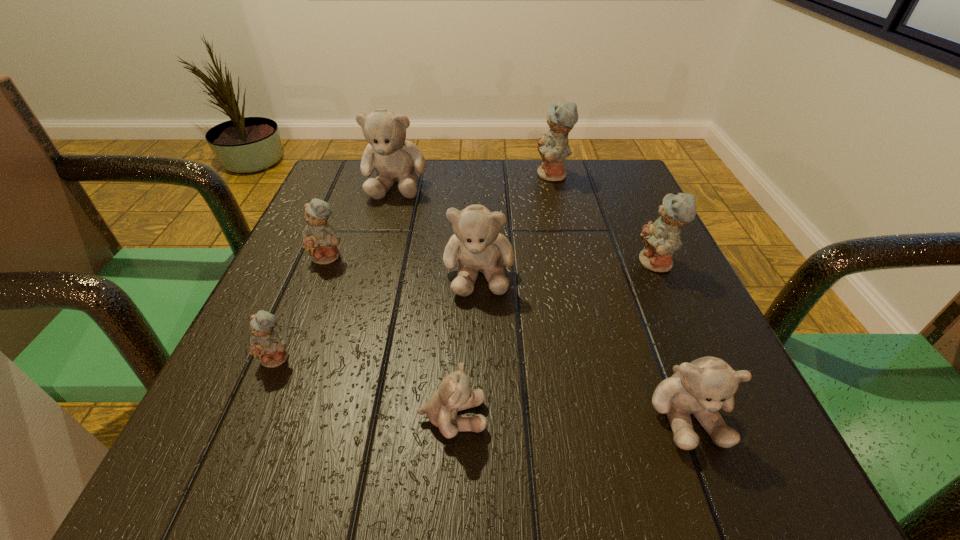
Image resolution: width=960 pixels, height=540 pixels. Find the location of `the smallest gray teddy bear`. the smallest gray teddy bear is located at coordinates (454, 394).

The image size is (960, 540). In order to click on vacant space located 0.250m on the front-facing side of the second blue teddy bear from right to left in this screenshot , I will do `click(431, 176)`.

Where is `vacant space located 0.180m on the front-facing side of the second blue teddy bear from right to left`? vacant space located 0.180m on the front-facing side of the second blue teddy bear from right to left is located at coordinates (460, 176).

This screenshot has width=960, height=540. In order to click on vacant area located 0.190m on the front-facing side of the second blue teddy bear from right to left in this screenshot , I will do `click(456, 176)`.

At what (x,y) coordinates should I click in order to perform the action: click on free region located 0.180m on the face of the biggest gray teddy bear. Please return your answer as a coordinate pair (x, y). Looking at the image, I should click on (375, 256).

At what (x,y) coordinates should I click in order to perform the action: click on vacant space located 0.270m on the front-facing side of the rightmost blue teddy bear. Please return your answer as a coordinate pair (x, y). Looking at the image, I should click on (492, 264).

I want to click on free spot located 0.260m on the front-facing side of the rightmost blue teddy bear, so tap(497, 264).

Locate an element on the screen. vacant space located 0.210m on the front-facing side of the rightmost blue teddy bear is located at coordinates (524, 264).

Where is `free spot located 0.130m on the face of the third smallest gray teddy bear`? free spot located 0.130m on the face of the third smallest gray teddy bear is located at coordinates (478, 366).

Locate an element on the screen. free location located 0.310m on the front-facing side of the second smallest blue teddy bear is located at coordinates (263, 419).